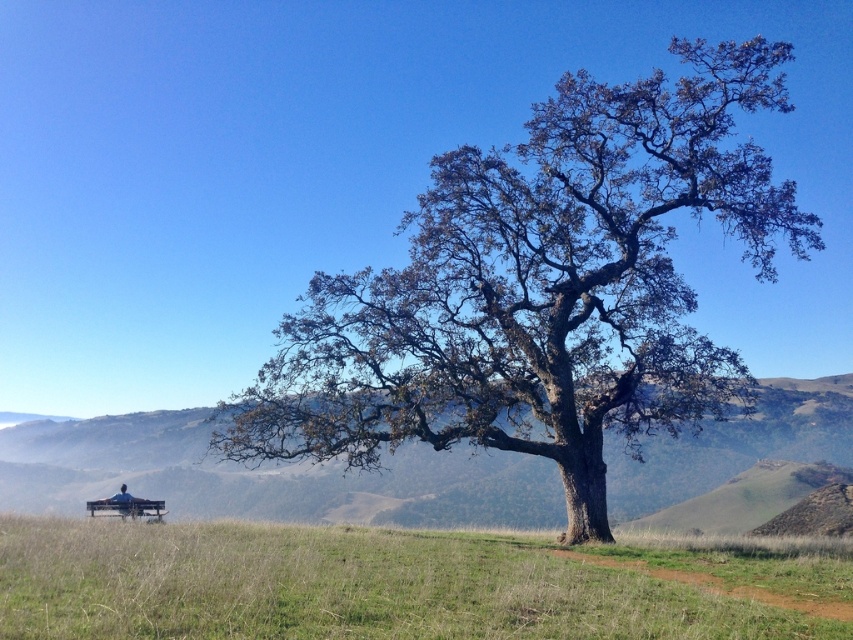
Question: Does green-brown bark tree at center lie behind green grassy at center?

Choices:
 (A) yes
 (B) no

Answer: (A)

Question: Which object is closer to the camera taking this photo?

Choices:
 (A) green grassy at center
 (B) green grassy hill at lower left
 (C) green-brown bark tree at center

Answer: (A)

Question: Considering the relative positions of green-brown bark tree at center and green grassy at center in the image provided, where is green-brown bark tree at center located with respect to green grassy at center?

Choices:
 (A) right
 (B) left

Answer: (A)

Question: Which of the following is the farthest from the observer?

Choices:
 (A) (398, 342)
 (B) (257, 492)
 (C) (288, 596)

Answer: (B)

Question: Does green-brown bark tree at center have a larger size compared to green grassy at center?

Choices:
 (A) no
 (B) yes

Answer: (B)

Question: Which point is farther to the camera?

Choices:
 (A) (740, 454)
 (B) (106, 624)
 (C) (561, 301)

Answer: (A)